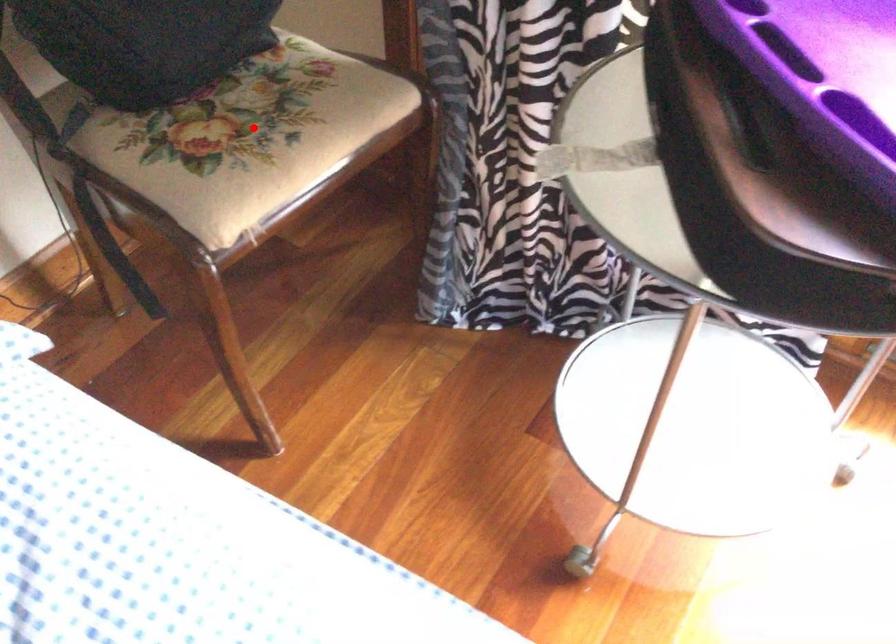
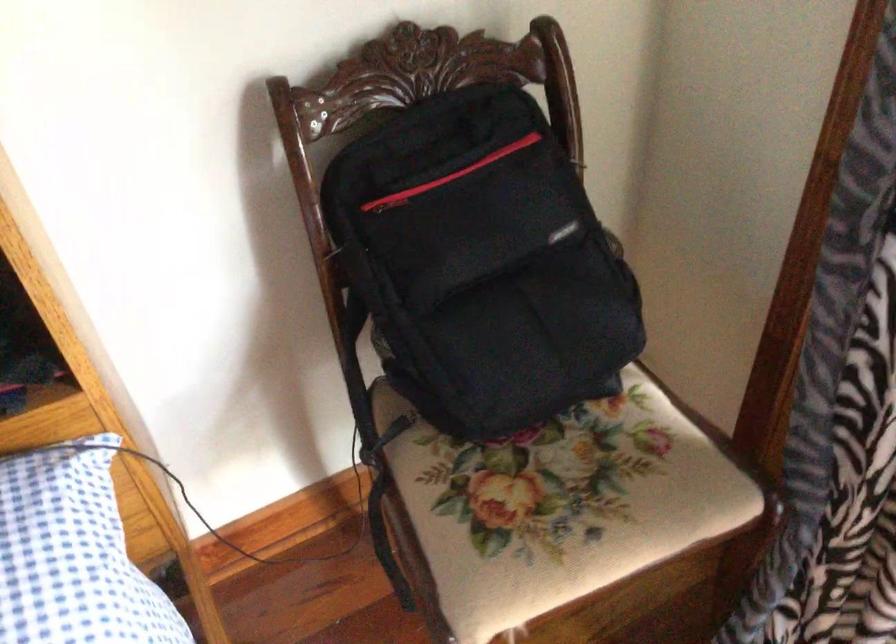
The point at the highlighted location is marked in the first image. Where is the corresponding point in the second image?

(556, 506)